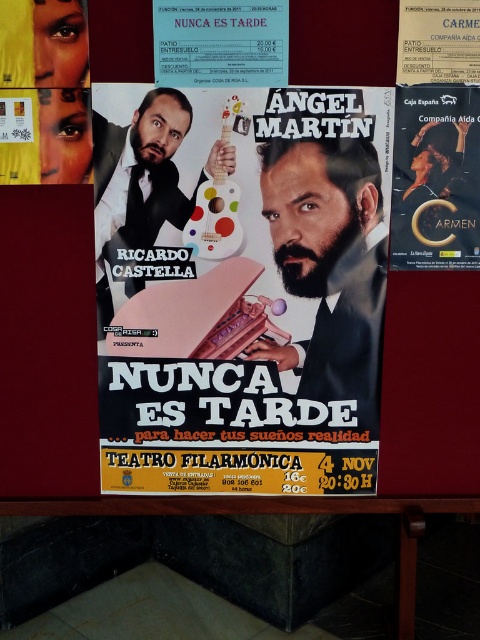
You are designing a digital version of this poster and need to ensure that the matte pink pastel at center and the matte black suit at center are spaced exactly 7 centimeters apart. Based on the current design, will you need to move them closer or farther apart?

The matte pink pastel at center and the matte black suit at center are currently 6.77 centimeters apart. Since 6.77 cm is less than 7 cm, you need to move them farther apart to achieve the desired spacing of 7 centimeters.

You are an event planner designing a stage setup for the theatrical performance. The stage has limited space, and you need to place both the matte black suit at center and the matte black poster at upper right. Given their sizes, which object requires more horizontal space?

The matte black suit at center requires more horizontal space because its width is larger than the matte black poster at upper right.

In the scene shown: You are a photographer who needs to capture a closeup of the matte pink pastel at center for a promotional shot. Your camera has a minimum focusing distance of 4 feet. Can you take the photo without moving the camera or the pastel?

The matte pink pastel at center and camera are 3.83 feet apart from each other, so yes, you can take the photo because the distance is within the camera minimum focusing distance of 4 feet.